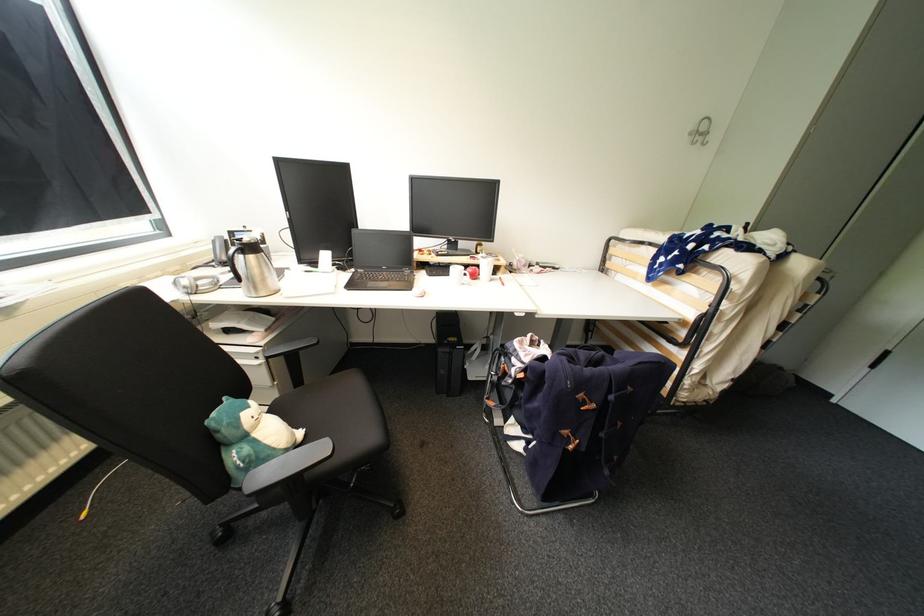
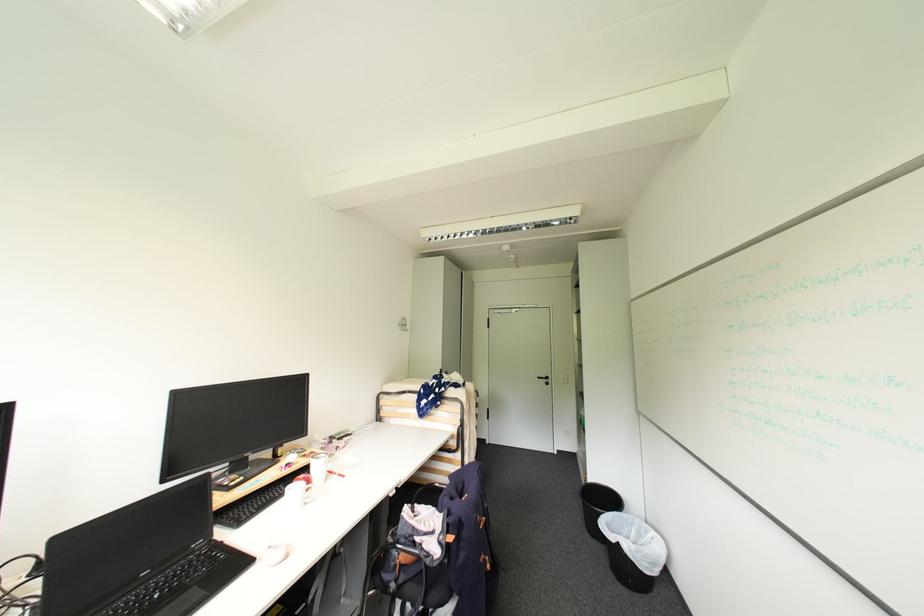
The point at (543,339) is marked in the first image. Where is the corresponding point in the second image?

(417, 506)